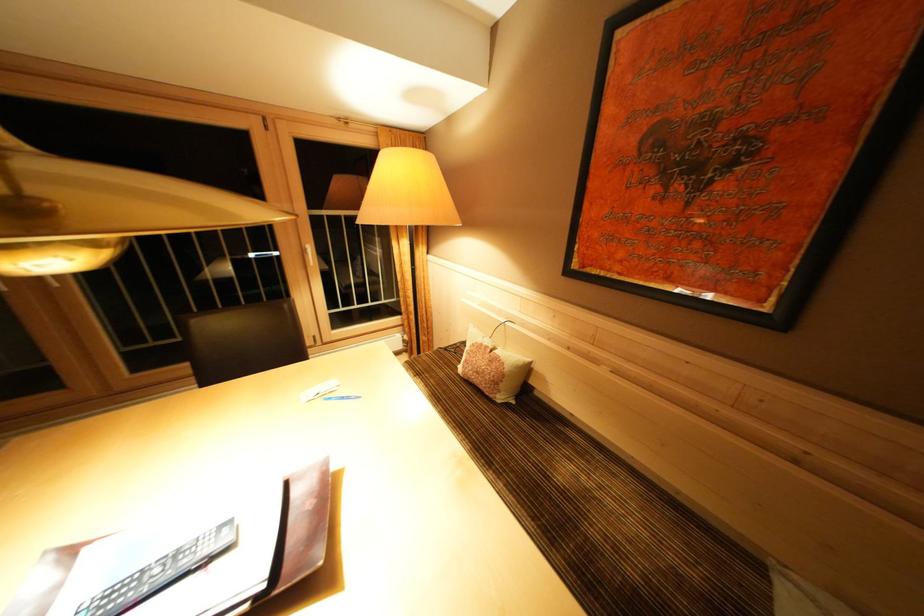
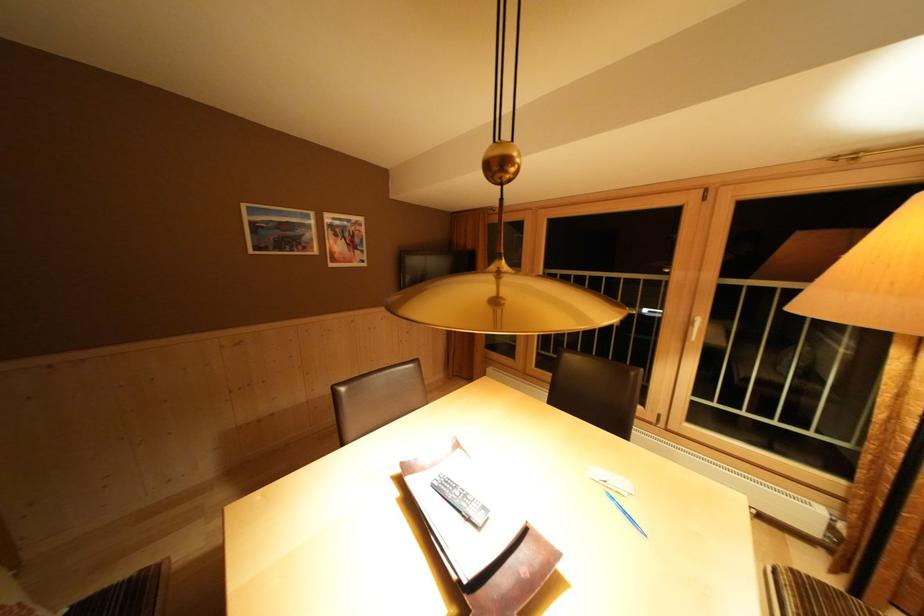
Question: The first image is from the beginning of the video and the second image is from the end. How did the camera likely rotate when shooting the video?

Choices:
 (A) Left
 (B) Right
 (C) Up
 (D) Down

Answer: (A)